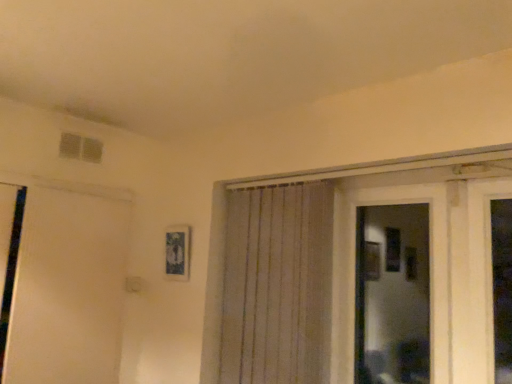
Question: Relative to white matte door at left, is transparent glass door at center in front or behind?

Choices:
 (A) behind
 (B) front

Answer: (B)

Question: In the image, is transparent glass door at center on the left side or the right side of white matte door at left?

Choices:
 (A) left
 (B) right

Answer: (B)

Question: Estimate the real-world distances between objects in this image. Which object is closer to the transparent glass door at center?

Choices:
 (A) white matte door at left
 (B) white textured curtain at center

Answer: (B)

Question: Estimate the real-world distances between objects in this image. Which object is closer to the white matte door at left?

Choices:
 (A) white textured curtain at center
 (B) transparent glass door at center

Answer: (A)